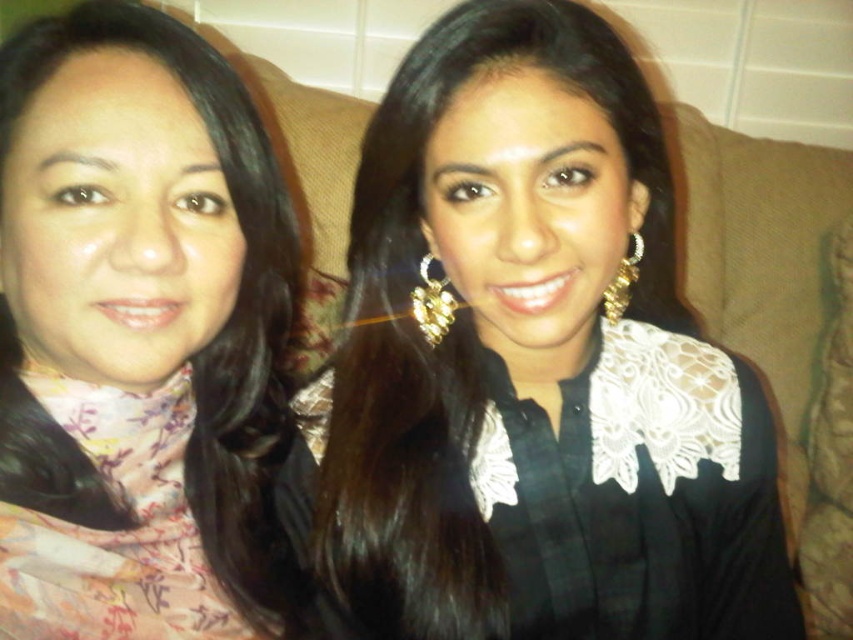
Which of these two, matte floral scarf at left or gold textured earring at upper right, stands shorter?

Standing shorter between the two is gold textured earring at upper right.

Which is above, matte floral scarf at left or gold textured earring at upper right?

Positioned higher is gold textured earring at upper right.

Find the location of a particular element. matte floral scarf at left is located at coordinates (225, 301).

In the scene shown: Between black lace blouse at center and gold textured earring at upper right, which one has more height?

black lace blouse at center is taller.

Who is more forward, (x=500, y=602) or (x=608, y=301)?

Point (x=500, y=602) is in front.

Does point (451, 618) lie in front of point (619, 317)?

Yes, point (451, 618) is in front of point (619, 317).

Identify the location of black lace blouse at center. This screenshot has height=640, width=853. (535, 364).

Who is more distant from viewer, (643, 513) or (247, 532)?

Result: Point (247, 532)

Who is shorter, black lace blouse at center or matte floral scarf at left?

Standing shorter between the two is matte floral scarf at left.

Who is more forward, (482,388) or (254,132)?

Positioned in front is point (254,132).

You are a GUI agent. You are given a task and a screenshot of the screen. Output one action in this format:
    pyautogui.click(x=<x>, y=<y>)
    Task: Click on the black lace blouse at center
    Image resolution: width=853 pixels, height=640 pixels.
    Given the screenshot: What is the action you would take?
    pyautogui.click(x=535, y=364)